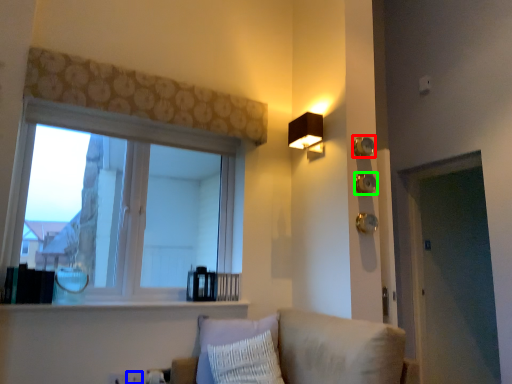
Question: Estimate the real-world distances between objects in this image. Which object is closer to knob (highlighted by a red box), electric outlet (highlighted by a blue box) or knob (highlighted by a green box)?

Choices:
 (A) electric outlet
 (B) knob

Answer: (B)